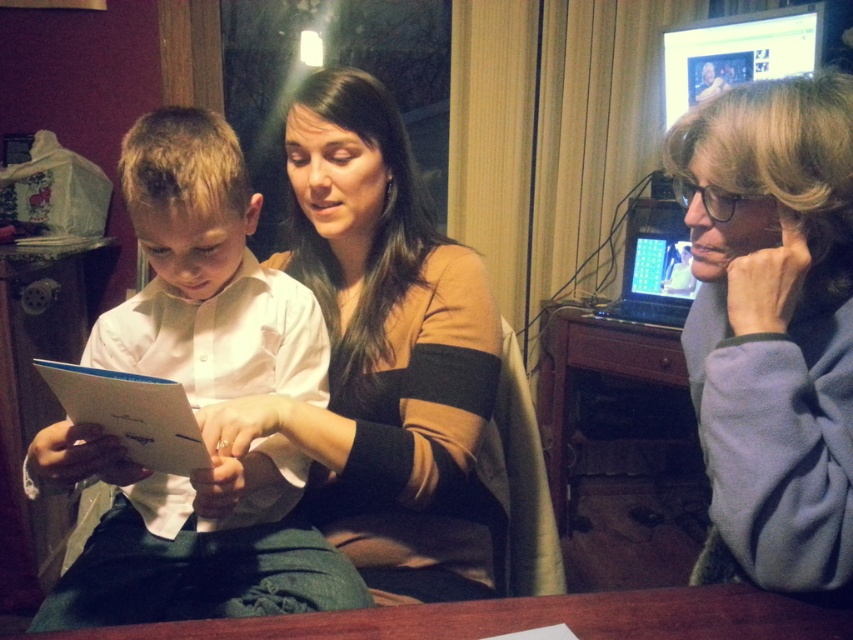
You are a delivery robot that needs to deliver a package to a point located at point (549, 612) in the image. The robot has a maximum reach distance of 80 centimeters. Can you reach the point from your current position?

The distance of point (549, 612) from the camera is 84.58 centimeters, which is beyond the robot s maximum reach of 80 centimeters. Therefore, the robot cannot reach the point from its current position.

You are a photographer trying to capture a closeup of the matte brown sweater at center and the brown wooden table at lower center in the scene. Since you can only focus on one object at a time, which object should you focus on first if you want to ensure both are in focus without moving the camera?

The matte brown sweater at center is located above the brown wooden table at lower center, so you should focus on the brown wooden table at lower center first. This way, the depth of field will extend upwards to include the matte brown sweater at center in focus as well.

You are a photographer trying to capture a candid shot of the scene. You want to ensure that both the matte brown sweater at center and the brown wooden table at lower center are clearly visible in the frame. Based on their positions, which object is closer to the camera?

The matte brown sweater at center is closer to the camera because the brown wooden table at lower center is positioned behind it.